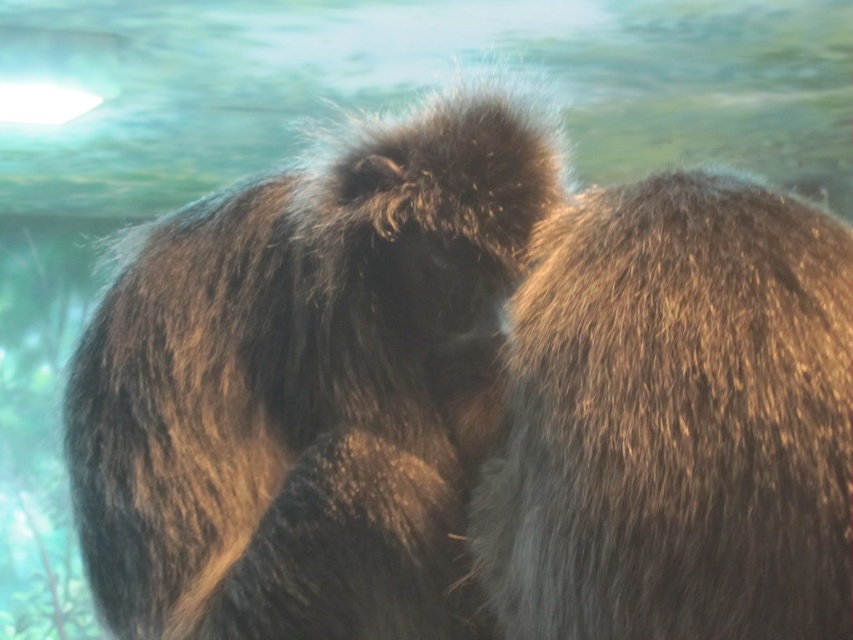
Question: Does brown fuzzy fur at center have a smaller size compared to fuzzy brown fur at upper right?

Choices:
 (A) yes
 (B) no

Answer: (B)

Question: Which object is farther from the camera taking this photo?

Choices:
 (A) fuzzy brown fur at upper right
 (B) brown fuzzy fur at center

Answer: (B)

Question: Is brown fuzzy fur at center further to camera compared to fuzzy brown fur at upper right?

Choices:
 (A) no
 (B) yes

Answer: (B)

Question: Which of the following is the farthest from the observer?

Choices:
 (A) (770, 388)
 (B) (408, 216)

Answer: (B)

Question: Where is brown fuzzy fur at center located in relation to fuzzy brown fur at upper right in the image?

Choices:
 (A) left
 (B) right

Answer: (A)